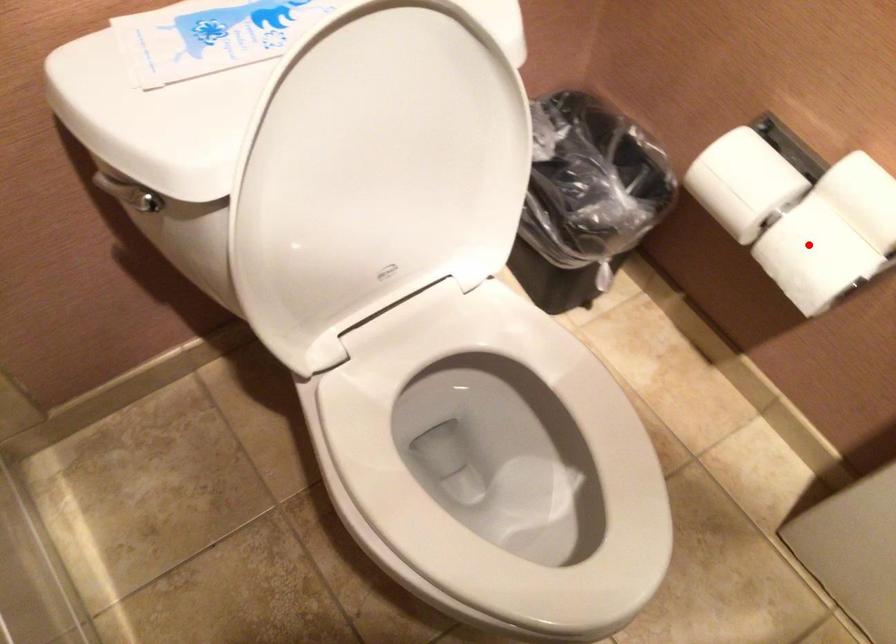
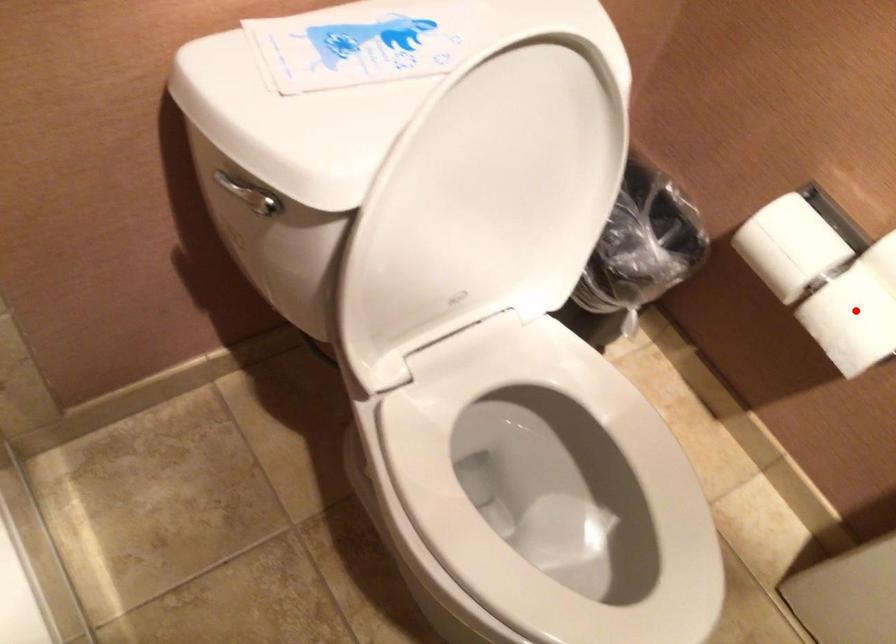
I am providing you with two images of the same scene from different viewpoints. A red point is marked on the first image and another point is marked on the second image. Do the highlighted points in image1 and image2 indicate the same real-world spot?

Yes